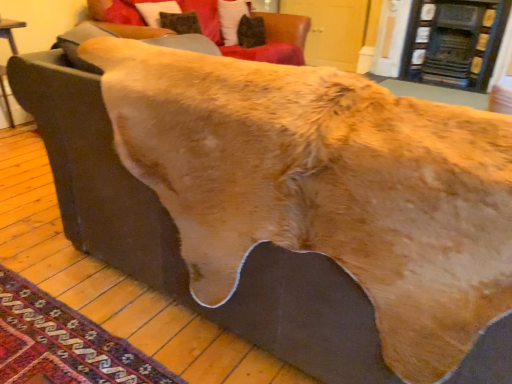
Question: Considering the relative sizes of fur-like fabric at upper center and velvet dark brown pillow at upper center in the image provided, is fur-like fabric at upper center bigger than velvet dark brown pillow at upper center?

Choices:
 (A) yes
 (B) no

Answer: (A)

Question: Can you confirm if fur-like fabric at upper center is smaller than velvet dark brown pillow at upper center?

Choices:
 (A) no
 (B) yes

Answer: (A)

Question: Is velvet dark brown pillow at upper center at the back of fur-like fabric at upper center?

Choices:
 (A) no
 (B) yes

Answer: (B)

Question: Can you confirm if fur-like fabric at upper center is positioned to the left of velvet dark brown pillow at upper center?

Choices:
 (A) yes
 (B) no

Answer: (A)

Question: Is fur-like fabric at upper center completely or partially outside of velvet dark brown pillow at upper center?

Choices:
 (A) no
 (B) yes

Answer: (B)

Question: From the image's perspective, is fur-like fabric at upper center positioned above or below velvet dark brown pillow at upper center?

Choices:
 (A) above
 (B) below

Answer: (B)

Question: In terms of height, does fur-like fabric at upper center look taller or shorter compared to velvet dark brown pillow at upper center?

Choices:
 (A) tall
 (B) short

Answer: (A)

Question: Is point (106, 3) positioned closer to the camera than point (246, 14)?

Choices:
 (A) closer
 (B) farther

Answer: (A)

Question: From a real-world perspective, is fur-like fabric at upper center above or below velvet dark brown pillow at upper center?

Choices:
 (A) above
 (B) below

Answer: (B)

Question: Considering their positions, is carpeted rug at lower left located in front of or behind fur-like fabric at upper center?

Choices:
 (A) front
 (B) behind

Answer: (A)

Question: From the image's perspective, relative to fur-like fabric at upper center, is carpeted rug at lower left above or below?

Choices:
 (A) below
 (B) above

Answer: (A)

Question: Is carpeted rug at lower left situated inside fur-like fabric at upper center or outside?

Choices:
 (A) outside
 (B) inside

Answer: (A)

Question: Is carpeted rug at lower left taller or shorter than fur-like fabric at upper center?

Choices:
 (A) tall
 (B) short

Answer: (B)

Question: Considering their positions, is velvet dark brown pillow at upper center located in front of or behind fur-like fabric at upper center?

Choices:
 (A) front
 (B) behind

Answer: (B)

Question: From a real-world perspective, relative to fur-like fabric at upper center, is velvet dark brown pillow at upper center vertically above or below?

Choices:
 (A) below
 (B) above

Answer: (B)